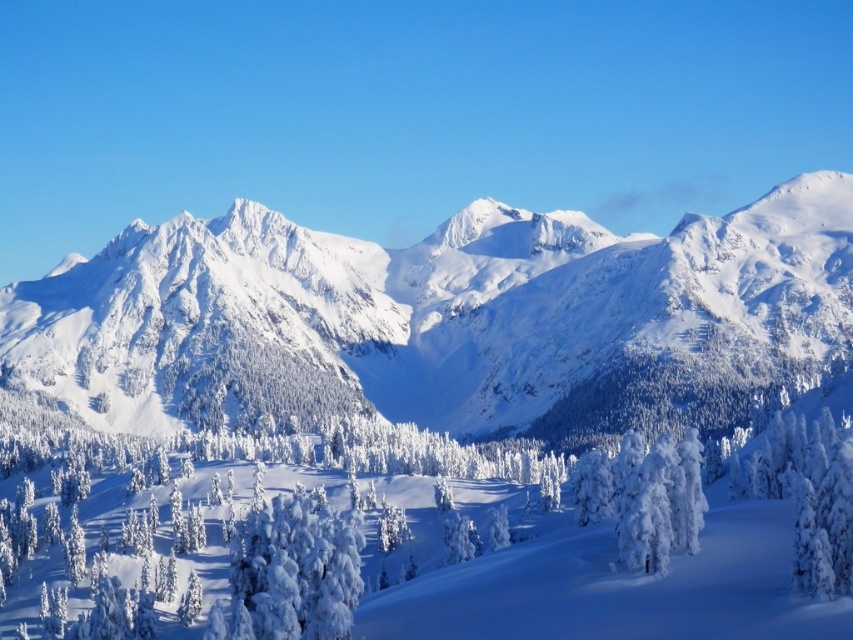
Locate an element on the screen. Image resolution: width=853 pixels, height=640 pixels. white snow-covered mountain range at center is located at coordinates (424, 307).

The image size is (853, 640). I want to click on white snow-covered mountain range at center, so click(424, 307).